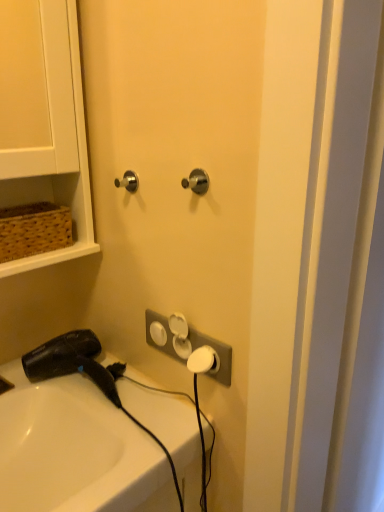
Question: From a real-world perspective, is satin nickel knob at center, acting as the first door handle starting from the right, located higher than white glossy sink at lower left?

Choices:
 (A) yes
 (B) no

Answer: (A)

Question: Can you confirm if satin nickel knob at center, acting as the first door handle starting from the right, is shorter than white glossy sink at lower left?

Choices:
 (A) yes
 (B) no

Answer: (A)

Question: Is satin nickel knob at center, arranged as the second door handle when viewed from the back, positioned behind white glossy sink at lower left?

Choices:
 (A) no
 (B) yes

Answer: (B)

Question: From the image's perspective, is satin nickel knob at center, the 1th door handle from the front, under white glossy sink at lower left?

Choices:
 (A) no
 (B) yes

Answer: (A)

Question: Considering the relative sizes of satin nickel knob at center, the second door handle from the left, and white glossy sink at lower left in the image provided, is satin nickel knob at center, the second door handle from the left, bigger than white glossy sink at lower left?

Choices:
 (A) no
 (B) yes

Answer: (A)

Question: From the image's perspective, is satin nickel knob at center, the 1th door handle from the front, located above white glossy sink at lower left?

Choices:
 (A) no
 (B) yes

Answer: (B)

Question: Is white plastic electric outlet at center closer to camera compared to satin nickel knob at center, arranged as the second door handle when viewed from the back?

Choices:
 (A) yes
 (B) no

Answer: (B)

Question: Is white plastic electric outlet at center not close to satin nickel knob at center, acting as the first door handle starting from the right?

Choices:
 (A) yes
 (B) no

Answer: (B)

Question: Considering the relative positions of white plastic electric outlet at center and satin nickel knob at center, the 1th door handle from the front, in the image provided, is white plastic electric outlet at center to the right of satin nickel knob at center, the 1th door handle from the front, from the viewer's perspective?

Choices:
 (A) no
 (B) yes

Answer: (A)

Question: Does white plastic electric outlet at center have a smaller size compared to satin nickel knob at center, acting as the first door handle starting from the right?

Choices:
 (A) yes
 (B) no

Answer: (B)

Question: Does white plastic electric outlet at center turn towards satin nickel knob at center, acting as the first door handle starting from the right?

Choices:
 (A) no
 (B) yes

Answer: (A)

Question: Does white plastic electric outlet at center lie behind satin nickel knob at center, the second door handle from the left?

Choices:
 (A) yes
 (B) no

Answer: (A)

Question: Does satin nickel door handle at upper left, arranged as the 1th door handle when viewed from the back, have a larger size compared to brown woven basket at upper left?

Choices:
 (A) no
 (B) yes

Answer: (A)